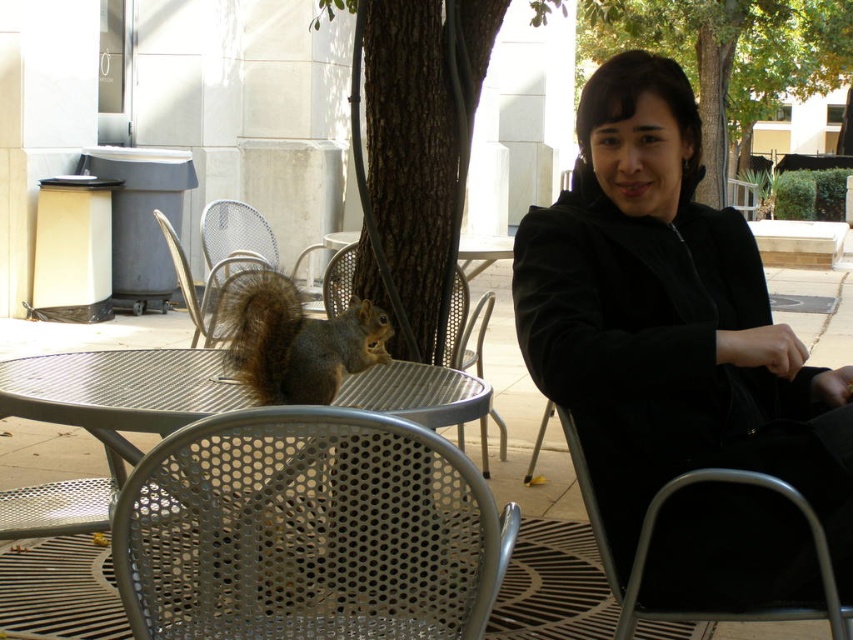
You are a photographer trying to capture a candid shot of the woman and the squirrel. You want to ensure the metallic silver chair at center is in the background while keeping the brown fur squirrel at center in focus. Based on their positions, which object should you place closer to the camera to achieve this effect?

To have the metallic silver chair at center in the background and the brown fur squirrel at center in focus, you should position the camera closer to the brown fur squirrel at center since it is to the left of the metallic silver chair at center, creating depth and keeping the squirrel sharp while the chair blurs slightly in the background.

You are a photographer trying to capture the brown fur squirrel at center and the metallic silver chair at center in a single shot. Based on their positions, can you determine if the squirrel is sitting on the chair or just near it?

The brown fur squirrel at center is located above metallic silver chair at center, so it is sitting on the chair.

You are standing in the outdoor seating area and want to take a photo of the green leafy tree at center. Where should you position yourself to capture it in the frame?

To capture the green leafy tree at center in the frame, position yourself so that the tree is centered at coordinates approximately 0.089 on the x and 0.856 on the y axis, as per its 2D location coordinates.